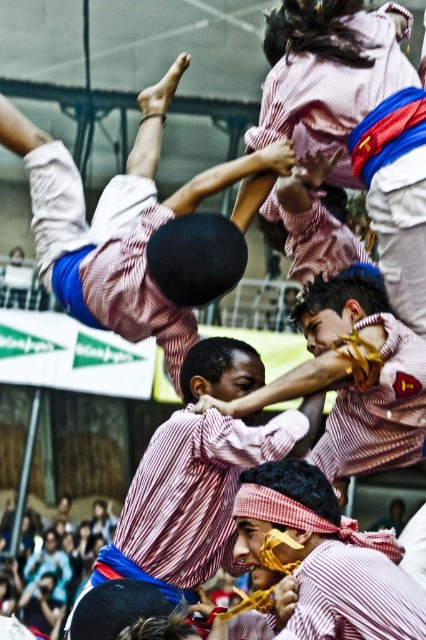
Is matte black ball at upper center thinner than striped fabric dancer at upper center?

In fact, matte black ball at upper center might be wider than striped fabric dancer at upper center.

Can you confirm if matte black ball at upper center is positioned to the left of striped fabric dancer at upper center?

Indeed, matte black ball at upper center is positioned on the left side of striped fabric dancer at upper center.

Is point (180, 54) closer to viewer compared to point (334, 122)?

No, (180, 54) is further to viewer.

Find the location of `matte black ball at upper center`. matte black ball at upper center is located at coordinates (135, 230).

Does striped fabric man at center have a smaller size compared to striped fabric headband at center?

No.

Does striped fabric man at center appear on the left side of striped fabric headband at center?

No, striped fabric man at center is not to the left of striped fabric headband at center.

Image resolution: width=426 pixels, height=640 pixels. What do you see at coordinates (351, 378) in the screenshot? I see `striped fabric man at center` at bounding box center [351, 378].

The image size is (426, 640). I want to click on striped fabric man at center, so click(351, 378).

Is point (184, 240) farther from viewer compared to point (127, 563)?

No, (184, 240) is closer to viewer.

Who is more forward, (91, 280) or (146, 528)?

Positioned in front is point (146, 528).

At what (x,y) coordinates should I click in order to perform the action: click on matte black ball at upper center. Please return your answer as a coordinate pair (x, y). The height and width of the screenshot is (640, 426). Looking at the image, I should click on (135, 230).